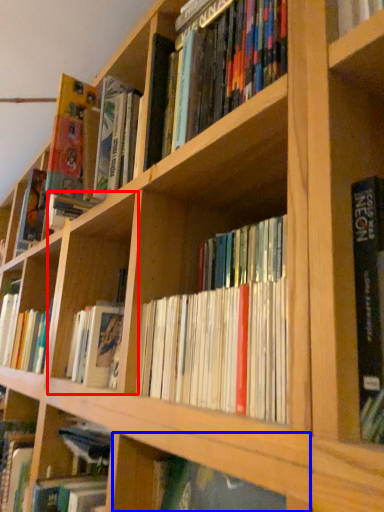
Question: Which object appears farthest to the camera in this image, cabinet (highlighted by a red box) or shelf (highlighted by a blue box)?

Choices:
 (A) cabinet
 (B) shelf

Answer: (A)